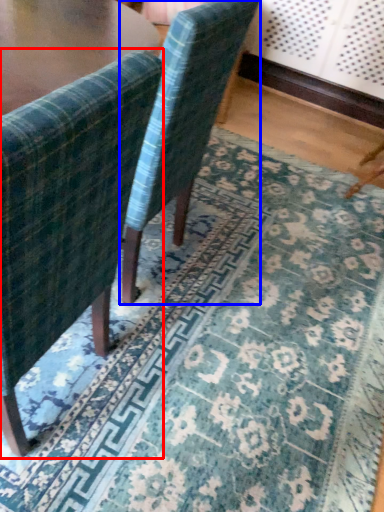
Question: Which of the following is the closest to the observer, chair (highlighted by a red box) or chair (highlighted by a blue box)?

Choices:
 (A) chair
 (B) chair

Answer: (A)